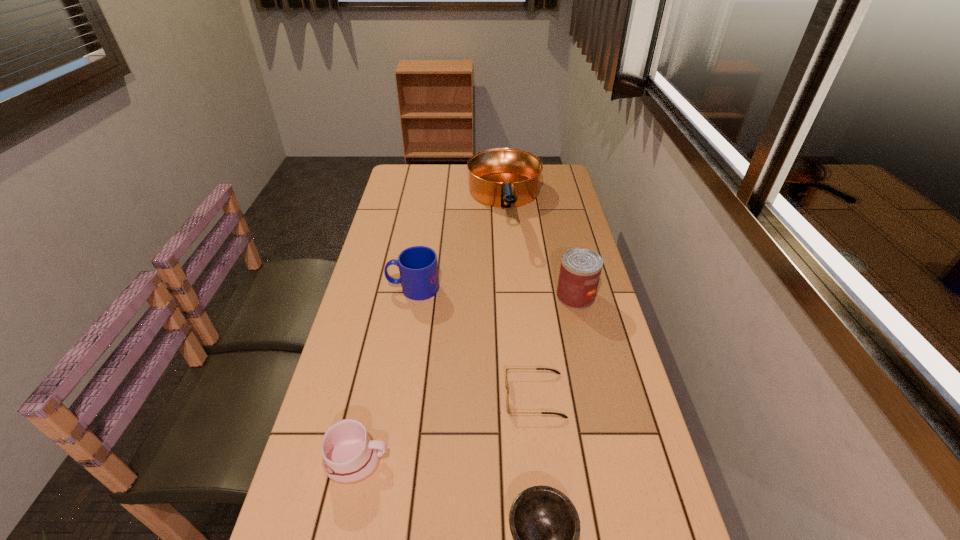
Find the location of a particular element. Image resolution: width=960 pixels, height=540 pixels. vacant area that lies between the sunglasses and the tallest object is located at coordinates [520, 300].

Identify the location of blank region between the taller mug and the third nearest object. [474, 342].

The width and height of the screenshot is (960, 540). What are the coordinates of `object that is the closest one to the third shortest object` in the screenshot? It's located at (545, 526).

Where is `object that is the fourth nearest to the second shortest object`? Image resolution: width=960 pixels, height=540 pixels. object that is the fourth nearest to the second shortest object is located at coordinates (x=418, y=267).

Identify the location of blank space that satisfies the following two spatial constraints: 1. on the side with the handle of the second tallest object; 2. on the right side of the taller mug. This screenshot has height=540, width=960. coord(412,296).

Where is `vacant position in the image that satisfies the following two spatial constraints: 1. on the handle side of the farthest object; 2. on the side with the handle of the fourth shortest object`? The height and width of the screenshot is (540, 960). vacant position in the image that satisfies the following two spatial constraints: 1. on the handle side of the farthest object; 2. on the side with the handle of the fourth shortest object is located at coordinates (512, 288).

This screenshot has height=540, width=960. I want to click on free point that satisfies the following two spatial constraints: 1. on the handle side of the tallest object; 2. on the side with the handle of the farther mug, so click(x=512, y=288).

Locate an element on the screen. This screenshot has height=540, width=960. vacant space that satisfies the following two spatial constraints: 1. on the back side of the second tallest object; 2. on the side with the handle of the fourth shortest object is located at coordinates (574, 288).

The width and height of the screenshot is (960, 540). I want to click on free space that satisfies the following two spatial constraints: 1. on the handle side of the farthest object; 2. on the left side of the fifth shortest object, so click(513, 296).

Identify the location of free region that satisfies the following two spatial constraints: 1. on the side with the handle of the fifth shortest object; 2. on the left side of the third tallest object. (412, 296).